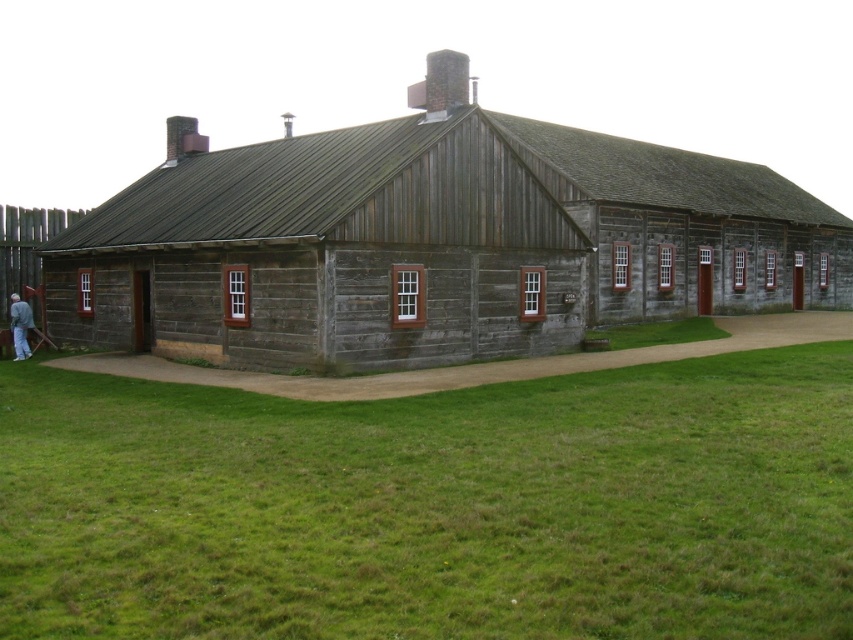
Can you confirm if green grass at lower center is thinner than gray fabric jacket at lower left?

No.

Which is in front, point (834, 467) or point (24, 342)?

Point (834, 467) is more forward.

You are a GUI agent. You are given a task and a screenshot of the screen. Output one action in this format:
    pyautogui.click(x=<x>, y=<y>)
    Task: Click on the green grass at lower center
    The height and width of the screenshot is (640, 853).
    Given the screenshot: What is the action you would take?
    click(434, 506)

Between point (700, 196) and point (18, 337), which one is positioned in front?

Point (18, 337)

Is point (384, 230) positioned behind point (16, 349)?

No, it is not.

Between point (433, 205) and point (19, 342), which one is positioned behind?

The point (19, 342) is more distant.

Where is `wooden hut at center`? Image resolution: width=853 pixels, height=640 pixels. wooden hut at center is located at coordinates (431, 243).

Which is in front, point (427, 520) or point (447, 150)?

Positioned in front is point (427, 520).

Who is shorter, green grass at lower center or wooden hut at center?

Standing shorter between the two is green grass at lower center.

You are a GUI agent. You are given a task and a screenshot of the screen. Output one action in this format:
    pyautogui.click(x=<x>, y=<y>)
    Task: Click on the green grass at lower center
    
    Given the screenshot: What is the action you would take?
    pyautogui.click(x=434, y=506)

The width and height of the screenshot is (853, 640). Find the location of `green grass at lower center`. green grass at lower center is located at coordinates (434, 506).